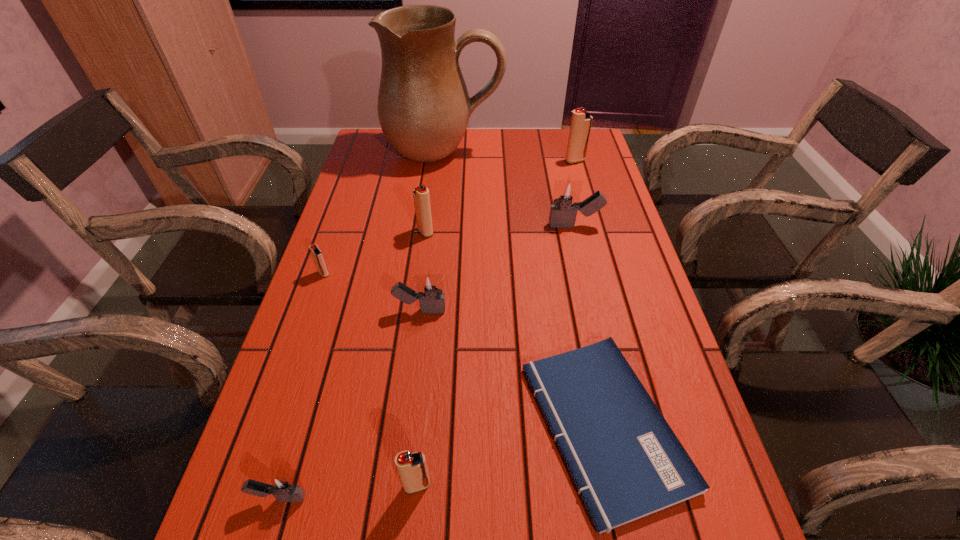
Where is `the third closest gray igniter to the blue paperback book`? the third closest gray igniter to the blue paperback book is located at coordinates (281, 487).

The image size is (960, 540). I want to click on vacant space that satisfies the following two spatial constraints: 1. at the spout of the rightmost gray igniter; 2. on the right side of the tallest object, so click(x=436, y=226).

Identify the location of free region that satisfies the following two spatial constraints: 1. on the front side of the third nearest red igniter; 2. on the left side of the shortest object. The width and height of the screenshot is (960, 540). (399, 426).

Where is `vacant area in the image that satisfies the following two spatial constraints: 1. at the spout of the shortest object; 2. on the left side of the cream pitcher`? This screenshot has height=540, width=960. vacant area in the image that satisfies the following two spatial constraints: 1. at the spout of the shortest object; 2. on the left side of the cream pitcher is located at coordinates (414, 426).